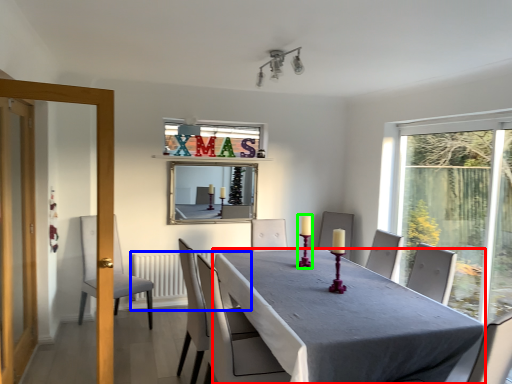
Question: Which object is positioned farthest from table (highlighted by a red box)? Select from radiator (highlighted by a blue box) and candle holder (highlighted by a green box).

Choices:
 (A) radiator
 (B) candle holder

Answer: (A)